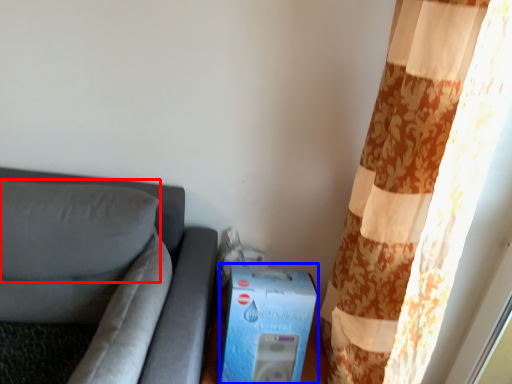
Question: Which object appears closest to the camera in this image, pillow (highlighted by a red box) or box (highlighted by a blue box)?

Choices:
 (A) pillow
 (B) box

Answer: (A)